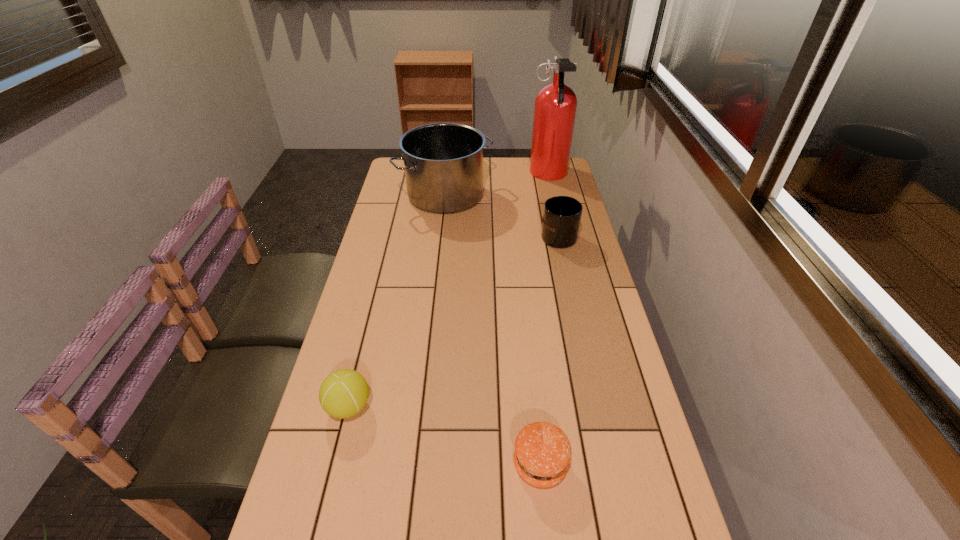
Image resolution: width=960 pixels, height=540 pixels. I want to click on mug that is at the right edge, so click(x=561, y=219).

The height and width of the screenshot is (540, 960). I want to click on object at the far left corner, so click(x=443, y=162).

Image resolution: width=960 pixels, height=540 pixels. Find the location of `object present at the far right corner`. object present at the far right corner is located at coordinates (555, 105).

I want to click on vacant region at the far edge, so click(522, 167).

Where is `free space at the left edge of the desktop`? The height and width of the screenshot is (540, 960). free space at the left edge of the desktop is located at coordinates (361, 318).

Find the location of `free location at the right edge of the desktop`. free location at the right edge of the desktop is located at coordinates (600, 322).

Where is `free space between the second nearest object and the saucepan`? free space between the second nearest object and the saucepan is located at coordinates (397, 301).

Locate an element on the screen. Image resolution: width=960 pixels, height=540 pixels. vacant space that is in between the nearest object and the fourth shortest object is located at coordinates (492, 329).

I want to click on free space between the patty and the fire extinguisher, so click(544, 320).

At what (x,y) coordinates should I click in order to perform the action: click on empty space between the saucepan and the tennis ball. Please return your answer as a coordinate pair (x, y). The image size is (960, 540). Looking at the image, I should click on (397, 301).